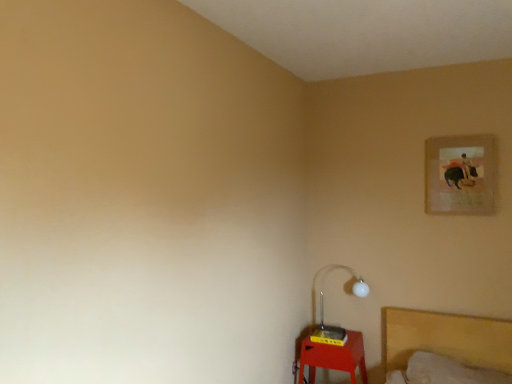
Where is `free space above yellow plastic table at lower right (from a real-world perspective)`? This screenshot has height=384, width=512. free space above yellow plastic table at lower right (from a real-world perspective) is located at coordinates (337, 334).